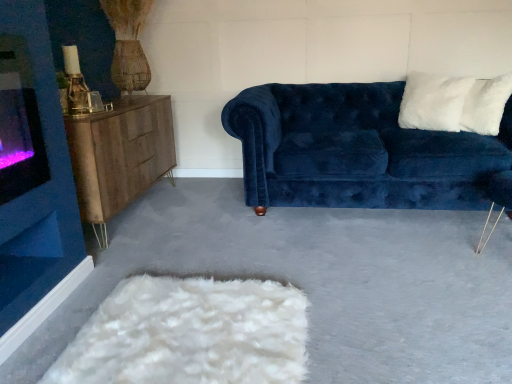
Question: Is white fluffy pillow at upper right wider or thinner than wooden sideboard at left?

Choices:
 (A) thin
 (B) wide

Answer: (A)

Question: Would you say white fluffy pillow at upper right is to the left or to the right of wooden sideboard at left in the picture?

Choices:
 (A) right
 (B) left

Answer: (A)

Question: Estimate the real-world distances between objects in this image. Which object is closer to the velvet blue couch at center?

Choices:
 (A) wooden sideboard at left
 (B) white fluffy pillow at upper right

Answer: (B)

Question: Which object is positioned farthest from the white fluffy pillow at upper right?

Choices:
 (A) velvet blue couch at center
 (B) wooden sideboard at left

Answer: (B)